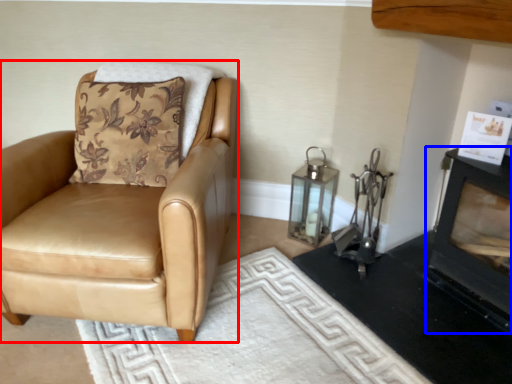
Question: Among these objects, which one is nearest to the camera, chair (highlighted by a red box) or fireplace (highlighted by a blue box)?

Choices:
 (A) chair
 (B) fireplace

Answer: (B)